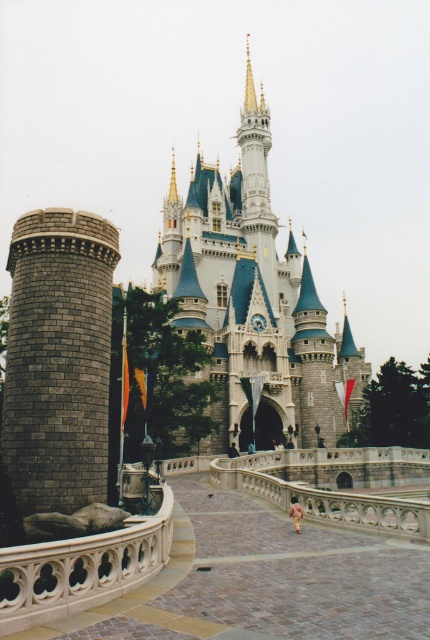
Is white stone castle at center closer to the viewer compared to gray brick tower at left?

No, it is behind gray brick tower at left.

Does white stone castle at center come behind gray brick tower at left?

Yes, it is.

This screenshot has width=430, height=640. In order to click on white stone castle at center in this screenshot , I will do `click(254, 300)`.